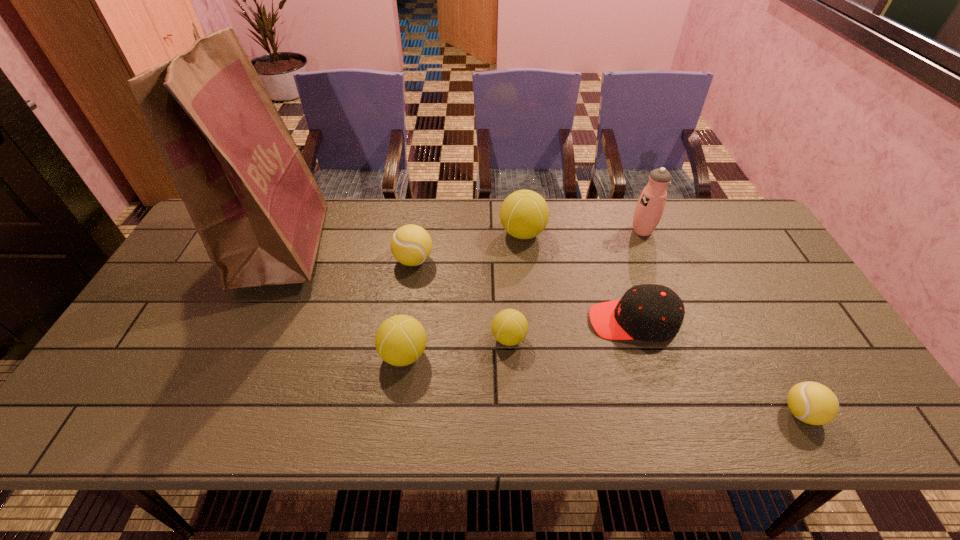
At what (x,y) coordinates should I click in order to perform the action: click on grocery bag. Please return your answer as a coordinate pair (x, y). This screenshot has height=540, width=960. Looking at the image, I should click on (256, 206).

This screenshot has height=540, width=960. I want to click on the tallest object, so click(x=256, y=206).

Locate an element on the screen. Image resolution: width=960 pixels, height=540 pixels. thermos bottle is located at coordinates (649, 209).

You are a GUI agent. You are given a task and a screenshot of the screen. Output one action in this format:
    pyautogui.click(x=<x>, y=<y>)
    Task: Click on the third tallest object
    
    Given the screenshot: What is the action you would take?
    pyautogui.click(x=524, y=214)

At what (x,y) coordinates should I click in order to perform the action: click on the biggest green tennis ball. Please return your answer as a coordinate pair (x, y). This screenshot has width=960, height=540. Looking at the image, I should click on (524, 214).

Where is `the farther yellow tennis ball`? The width and height of the screenshot is (960, 540). the farther yellow tennis ball is located at coordinates (411, 245).

You are a GUI agent. You are given a task and a screenshot of the screen. Output one action in this format:
    pyautogui.click(x=<x>, y=<y>)
    Task: Click on the bigger yellow tennis ball
    This screenshot has height=540, width=960.
    Given the screenshot: What is the action you would take?
    pyautogui.click(x=411, y=245)

The width and height of the screenshot is (960, 540). I want to click on the second smallest green tennis ball, so click(x=400, y=340).

Image resolution: width=960 pixels, height=540 pixels. What are the coordinates of `cap` in the screenshot? It's located at (648, 312).

Find the location of a particular element. the nearer yellow tennis ball is located at coordinates (813, 403).